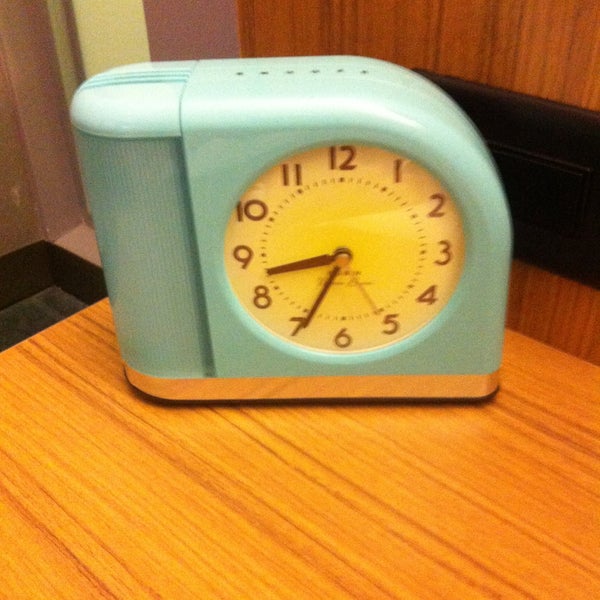
This screenshot has width=600, height=600. I want to click on metal clock base, so click(x=274, y=386).